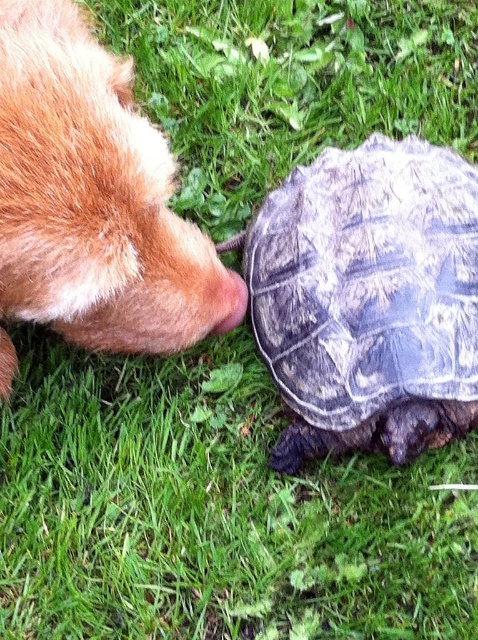
Question: Can you confirm if leathery brown tortoise at center is positioned above fuzzy fur nose at left?

Choices:
 (A) yes
 (B) no

Answer: (B)

Question: Can you confirm if leathery brown tortoise at center is smaller than brown fur nose at left?

Choices:
 (A) no
 (B) yes

Answer: (A)

Question: Which of these objects is positioned closest to the leathery brown tortoise at center?

Choices:
 (A) brown fur nose at left
 (B) fuzzy fur nose at left

Answer: (A)

Question: Among these objects, which one is nearest to the camera?

Choices:
 (A) fuzzy fur nose at left
 (B) brown fur nose at left

Answer: (A)

Question: Which of the following is the closest to the observer?

Choices:
 (A) leathery brown tortoise at center
 (B) fuzzy fur nose at left

Answer: (B)

Question: Does leathery brown tortoise at center have a larger size compared to fuzzy fur nose at left?

Choices:
 (A) yes
 (B) no

Answer: (B)